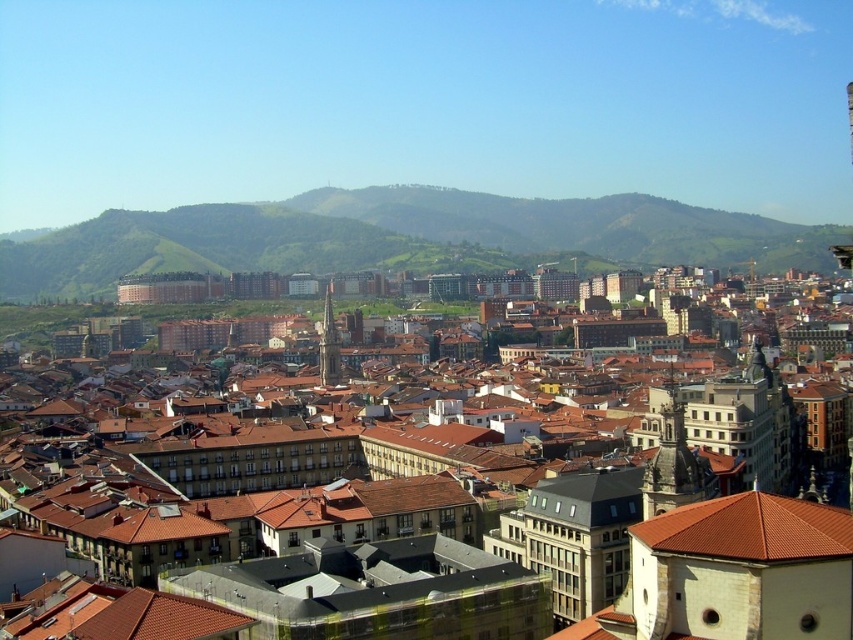
You are standing in the city and want to locate the smooth stone tower at center right. From your vantage point, which direction should you look relative to the brown tiled roofs at center?

You should look to the right of the brown tiled roofs at center to find the smooth stone tower at center right.

You are standing at the edge of the city looking towards the green grassy hill at center and the brown tiled roofs at center. Which object appears higher in the scene?

The green grassy hill at center appears higher because it is much taller than the brown tiled roofs at center.

Looking at the cityscape, where is the green grassy hill at center in relation to the brown tiled roofs at center?

The green grassy hill at center is to the left of the brown tiled roofs at center.